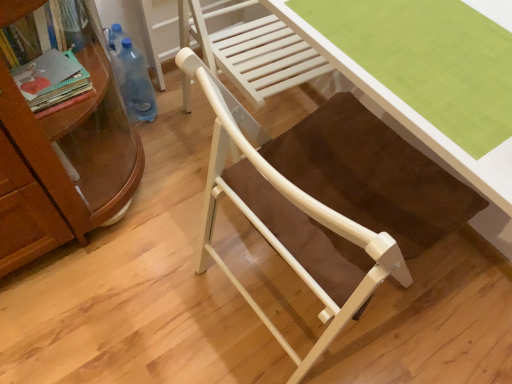
You are a GUI agent. You are given a task and a screenshot of the screen. Output one action in this format:
    pyautogui.click(x=<x>, y=<y>)
    Task: Click on the matte white chair at center
    The height and width of the screenshot is (384, 512).
    Given the screenshot: What is the action you would take?
    pyautogui.click(x=291, y=219)

Is blue plastic bottle at left positioned behind matte white chair at center?

Yes, blue plastic bottle at left is further from the viewer.

Is matte white chair at center inside blue plastic bottle at left?

No, matte white chair at center is not a part of blue plastic bottle at left.

Is blue plastic bottle at left facing away from matte white chair at center?

No, matte white chair at center is not at the back of blue plastic bottle at left.

Considering the relative sizes of matte white chair at center and green fabric desk at center in the image provided, is matte white chair at center wider than green fabric desk at center?

Indeed, matte white chair at center has a greater width compared to green fabric desk at center.

Does matte white chair at center contain green fabric desk at center?

Indeed, green fabric desk at center is located within matte white chair at center.

Is matte white chair at center next to green fabric desk at center and touching it?

No, matte white chair at center is not touching green fabric desk at center.

From a real-world perspective, who is located higher, green fabric desk at center or blue plastic bottle at left?

In real-world perspective, green fabric desk at center is above.

Identify the location of bottle below the green fabric desk at center (from a real-world perspective). (137, 83).

In the image, is green fabric desk at center positioned in front of or behind blue plastic bottle at left?

green fabric desk at center is in front of blue plastic bottle at left.

Consider the image. From the image's perspective, would you say blue plastic bottle at left is shown under green fabric desk at center?

No, from the image's perspective, blue plastic bottle at left is not below green fabric desk at center.

Is point (123, 81) more distant than point (378, 96)?

Yes, it is behind point (378, 96).

Considering the relative sizes of blue plastic bottle at left and green fabric desk at center in the image provided, is blue plastic bottle at left smaller than green fabric desk at center?

No, blue plastic bottle at left is not smaller than green fabric desk at center.

The height and width of the screenshot is (384, 512). Find the location of `desk above the matte white chair at center (from the image's perspective)`. desk above the matte white chair at center (from the image's perspective) is located at coordinates (413, 116).

Which is behind, green fabric desk at center or matte white chair at center?

Positioned behind is green fabric desk at center.

From the image's perspective, is green fabric desk at center below matte white chair at center?

No.

Does green fabric desk at center have a larger size compared to matte white chair at center?

No.

From a real-world perspective, is matte white chair at center physically located above or below blue plastic bottle at left?

Clearly, from a real-world perspective, matte white chair at center is above blue plastic bottle at left.

Is matte white chair at center to the right of blue plastic bottle at left from the viewer's perspective?

Correct, you'll find matte white chair at center to the right of blue plastic bottle at left.

Does matte white chair at center have a lesser width compared to blue plastic bottle at left?

Incorrect, the width of matte white chair at center is not less than that of blue plastic bottle at left.

You are a GUI agent. You are given a task and a screenshot of the screen. Output one action in this format:
    pyautogui.click(x=<x>, y=<y>)
    Task: Click on the chair located below the blue plastic bottle at left (from the image's perspective)
    Image resolution: width=512 pixels, height=384 pixels.
    Given the screenshot: What is the action you would take?
    pyautogui.click(x=291, y=219)

This screenshot has width=512, height=384. Find the location of `bottle above the matte white chair at center (from the image's perspective)`. bottle above the matte white chair at center (from the image's perspective) is located at coordinates (137, 83).

Image resolution: width=512 pixels, height=384 pixels. I want to click on chair in front of the green fabric desk at center, so click(x=291, y=219).

Looking at the image, which one is located further to green fabric desk at center, blue plastic bottle at left or matte white chair at center?

blue plastic bottle at left is positioned further to the anchor green fabric desk at center.

Based on their spatial positions, is blue plastic bottle at left or green fabric desk at center closer to matte white chair at center?

green fabric desk at center lies closer to matte white chair at center than the other object.

Based on their spatial positions, is green fabric desk at center or blue plastic bottle at left further from matte white chair at center?

Among the two, blue plastic bottle at left is located further to matte white chair at center.

When comparing their distances from blue plastic bottle at left, does green fabric desk at center or matte white chair at center seem closer?

matte white chair at center is closer to blue plastic bottle at left.

Looking at the image, which one is located further to blue plastic bottle at left, matte white chair at center or green fabric desk at center?

The object further to blue plastic bottle at left is green fabric desk at center.

Estimate the real-world distances between objects in this image. Which object is further from green fabric desk at center, matte white chair at center or blue plastic bottle at left?

blue plastic bottle at left lies further to green fabric desk at center than the other object.

Where is `desk positioned between matte white chair at center and blue plastic bottle at left from near to far`? This screenshot has height=384, width=512. desk positioned between matte white chair at center and blue plastic bottle at left from near to far is located at coordinates (413, 116).